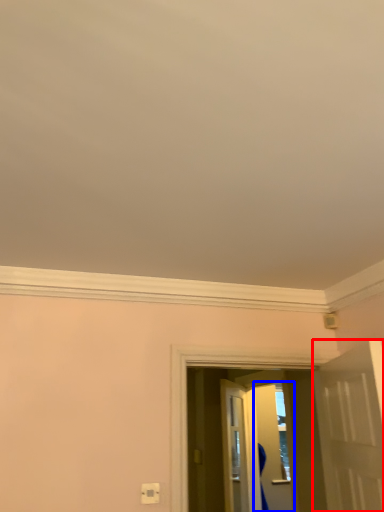
Question: Which point is closer to the camera, door (highlighted by a red box) or screen door (highlighted by a blue box)?

Choices:
 (A) door
 (B) screen door

Answer: (A)